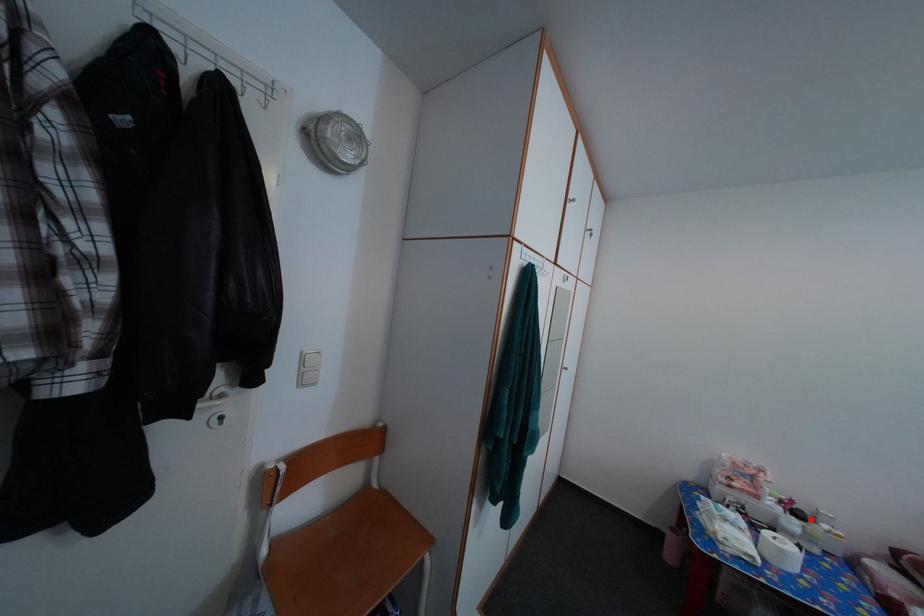
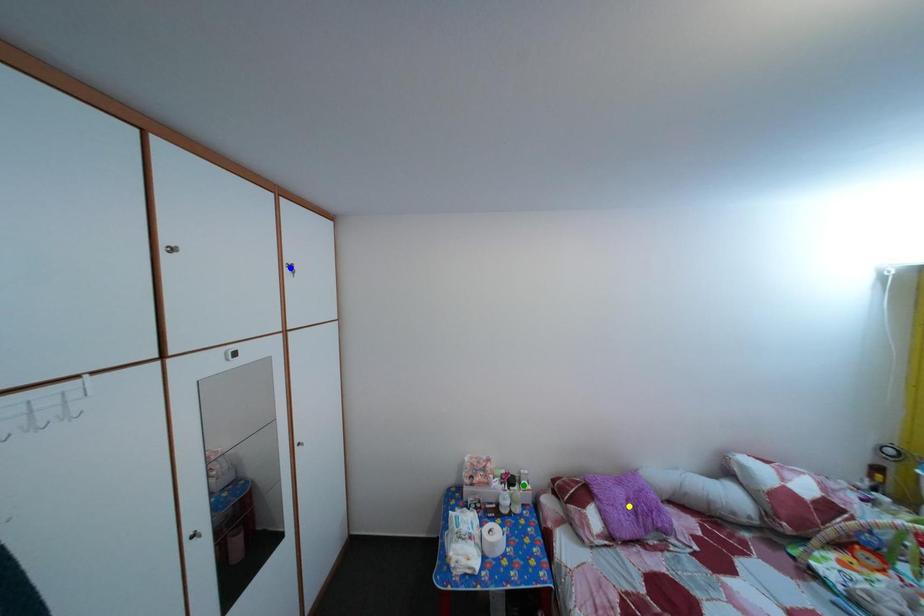
Question: I am providing you with two images of the same scene from different viewpoints. A red point is marked on the first image. You are given multiple points on the second image. Which mark in image 2 goes with the point in image 1?

Choices:
 (A) blue point
 (B) yellow point
 (C) green point

Answer: (C)